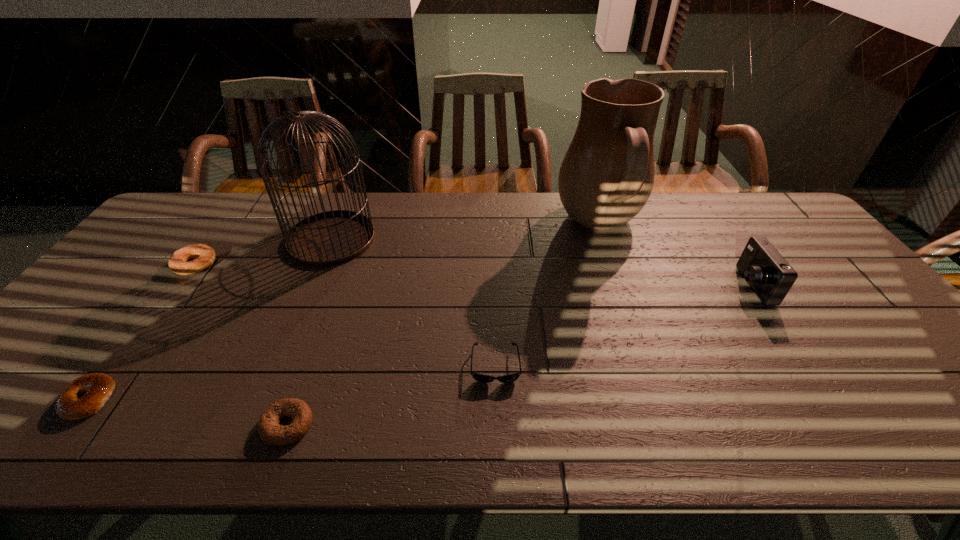
Identify the location of free spot at the far edge of the desktop. The image size is (960, 540). (474, 225).

Locate an element on the screen. vacant space at the near edge of the desktop is located at coordinates (204, 439).

You are a GUI agent. You are given a task and a screenshot of the screen. Output one action in this format:
    pyautogui.click(x=<x>, y=<y>)
    Task: Click on the vacant area at the left edge of the desktop
    The width and height of the screenshot is (960, 540).
    Given the screenshot: What is the action you would take?
    pyautogui.click(x=108, y=306)

I want to click on blank space at the far left corner of the desktop, so click(x=193, y=192).

I want to click on vacant space that is in between the farthest bagel and the camera, so click(473, 275).

Image resolution: width=960 pixels, height=540 pixels. Identify the location of free point between the tallest bagel and the second object from right to left. (397, 246).

Find the location of `unoccupied position between the tallest bagel and the second object from right to left`. unoccupied position between the tallest bagel and the second object from right to left is located at coordinates (397, 246).

Identify the location of vacant space that's between the cream pitcher and the tallest bagel. click(397, 246).

Identify the location of free space between the birdcage and the tallest bagel. Image resolution: width=960 pixels, height=540 pixels. (264, 252).

Where is `vacant region between the farthest bagel and the sunglasses`? Image resolution: width=960 pixels, height=540 pixels. vacant region between the farthest bagel and the sunglasses is located at coordinates (346, 315).